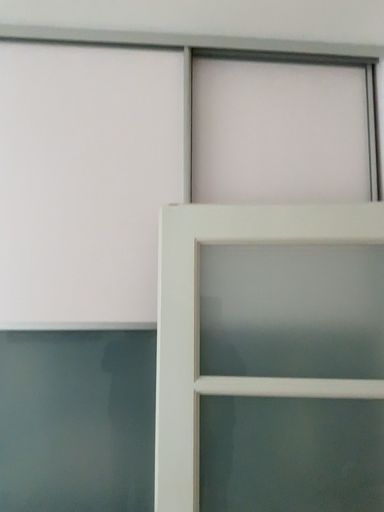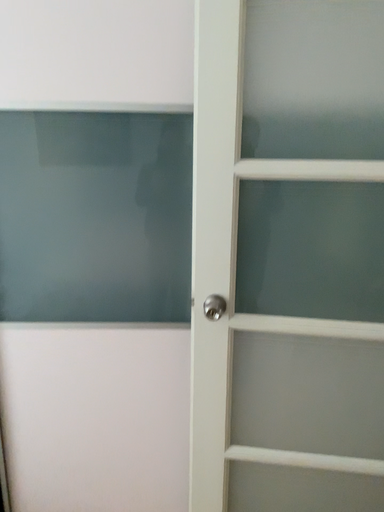
Question: Which way did the camera rotate in the video?

Choices:
 (A) rotated downward
 (B) rotated upward

Answer: (A)